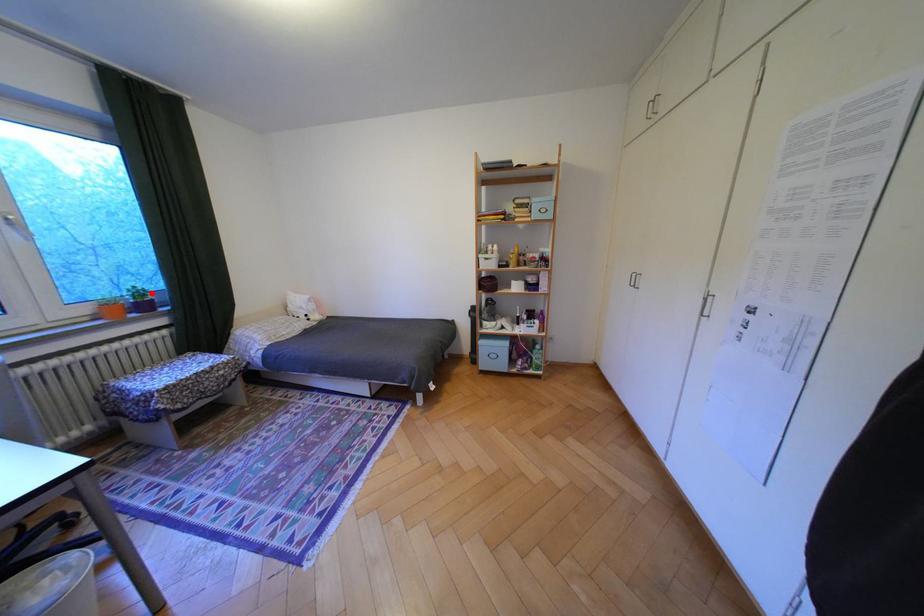
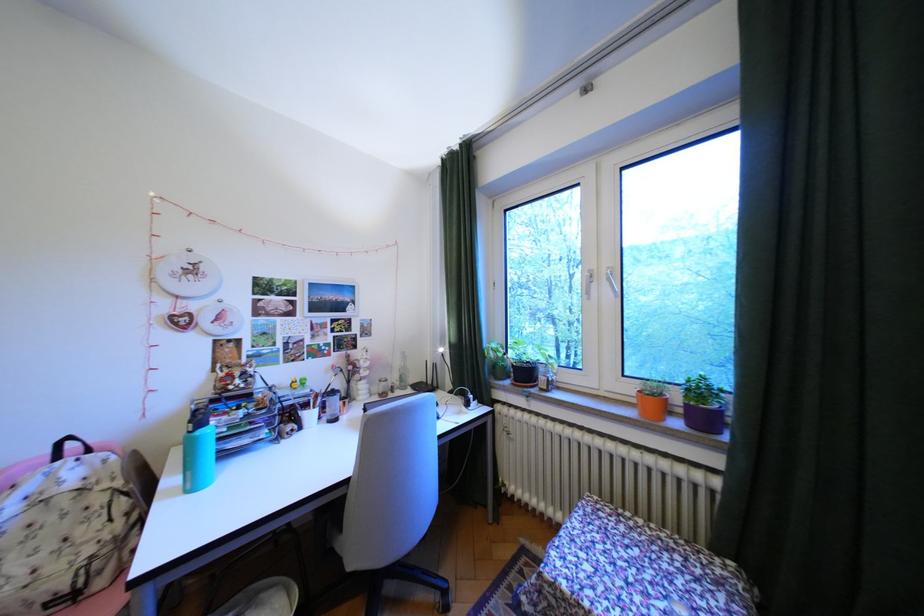
The point at the highlighted location is marked in the first image. Where is the corresponding point in the second image?

(710, 391)